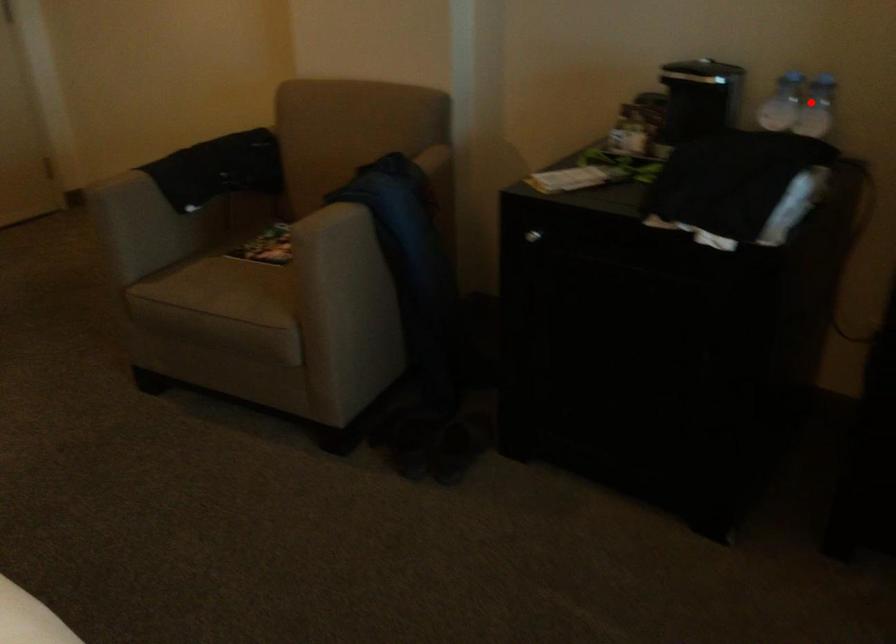
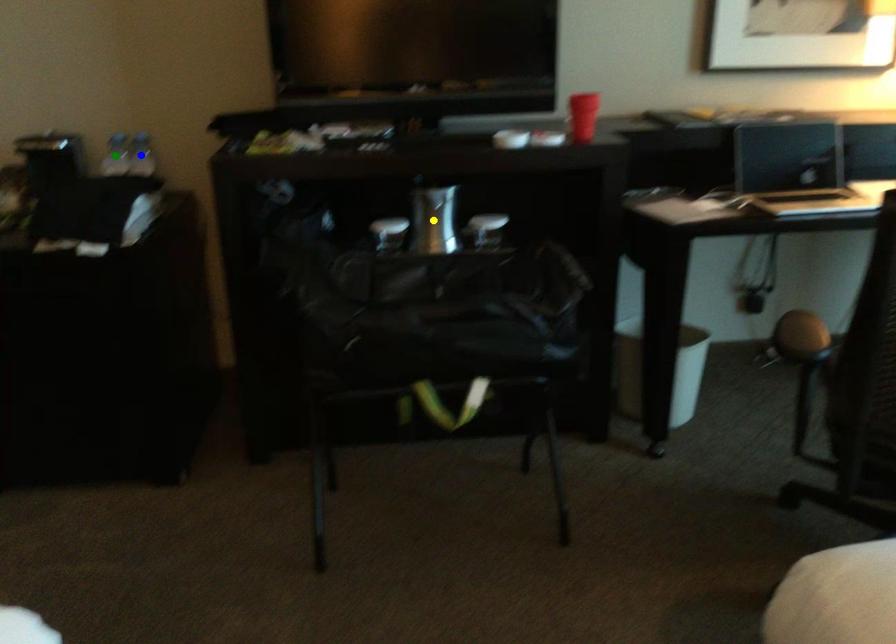
Question: I am providing you with two images of the same scene from different viewpoints. A red point is marked on the first image. You are given multiple points on the second image. Can you choose the point in image 2 that corresponds to the point in image 1?

Choices:
 (A) blue point
 (B) green point
 (C) yellow point

Answer: (A)